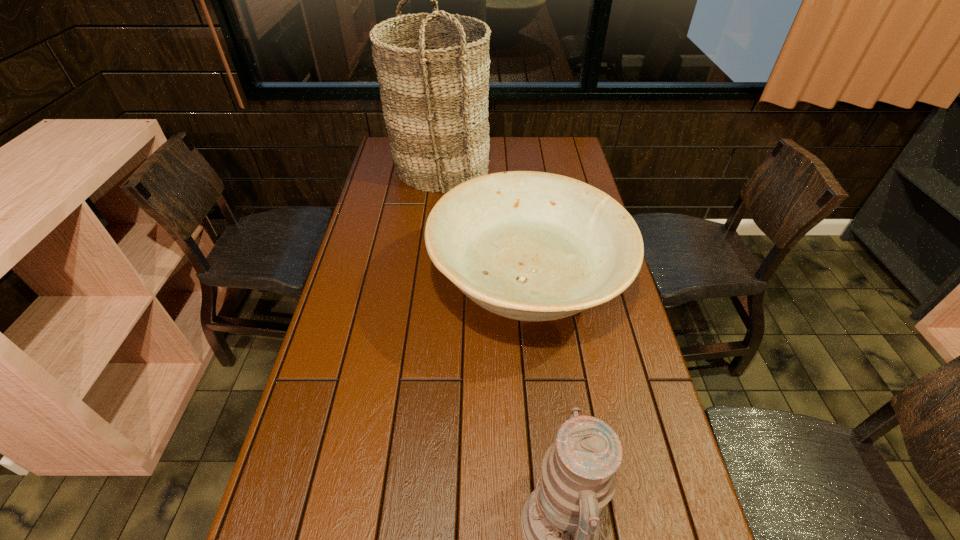
You are a GUI agent. You are given a task and a screenshot of the screen. Output one action in this format:
    pyautogui.click(x=<x>, y=<y>)
    Task: Click on the tallest object
    This screenshot has width=960, height=540.
    Given the screenshot: What is the action you would take?
    pyautogui.click(x=435, y=101)

Find the location of a particular element. The width and height of the screenshot is (960, 540). basket is located at coordinates (435, 101).

Where is `the shortest object`? The height and width of the screenshot is (540, 960). the shortest object is located at coordinates (532, 246).

In order to click on dish in this screenshot , I will do `click(532, 246)`.

Where is `free spot located 0.280m on the front of the tallest object`? Image resolution: width=960 pixels, height=540 pixels. free spot located 0.280m on the front of the tallest object is located at coordinates (431, 247).

This screenshot has width=960, height=540. In order to click on vacant space located 0.140m on the front of the shortest object in this screenshot , I will do `click(541, 422)`.

At what (x,y) coordinates should I click in order to perform the action: click on object that is at the far edge. Please return your answer as a coordinate pair (x, y). The width and height of the screenshot is (960, 540). Looking at the image, I should click on (435, 101).

Identify the location of object situated at the left edge. Image resolution: width=960 pixels, height=540 pixels. (435, 101).

Where is `object that is at the right edge`? The height and width of the screenshot is (540, 960). object that is at the right edge is located at coordinates [x=532, y=246].

Locate an element on the screen. The image size is (960, 540). object present at the far left corner is located at coordinates (435, 101).